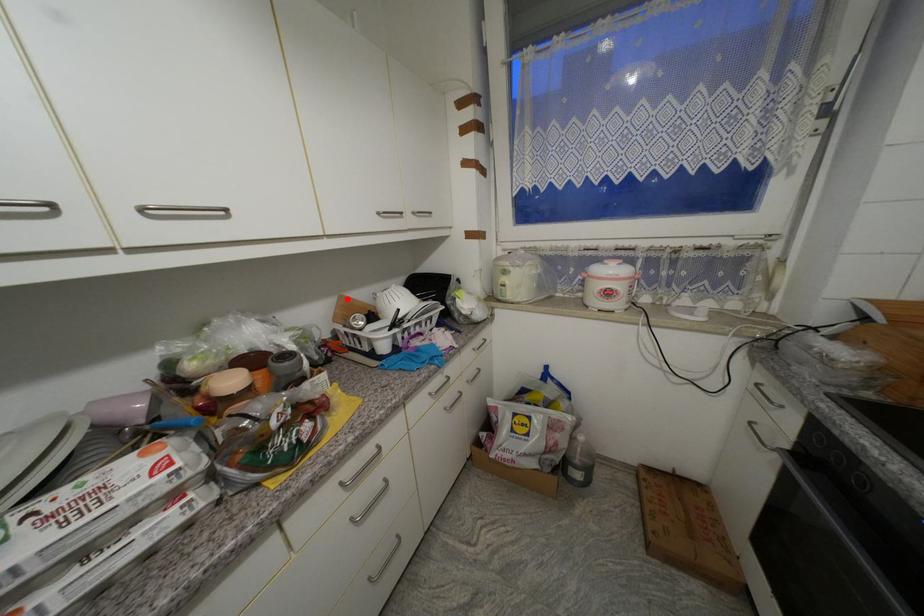
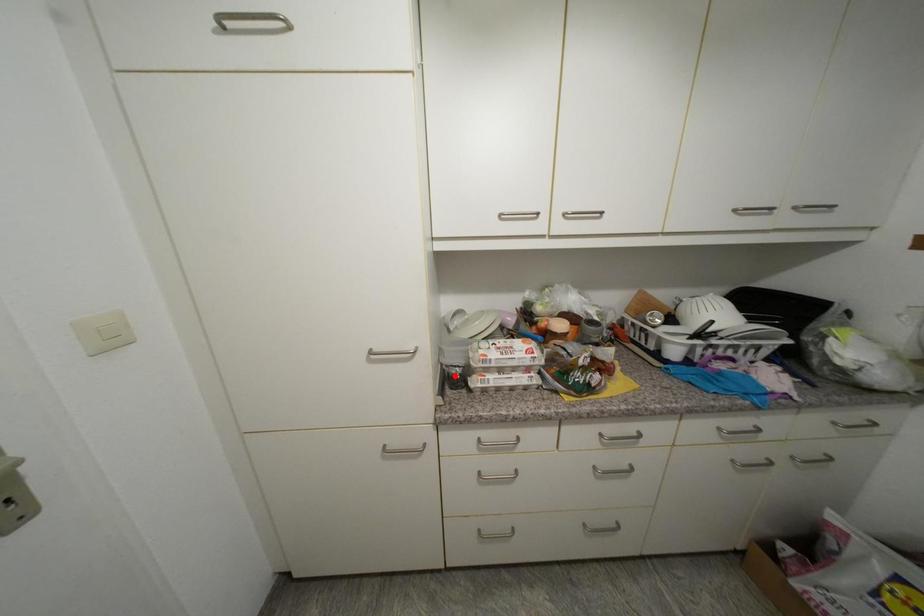
I am providing you with two images of the same scene from different viewpoints. A red point is marked on the first image and another point is marked on the second image. Do the highlighted points in image1 and image2 indicate the same real-world spot?

No